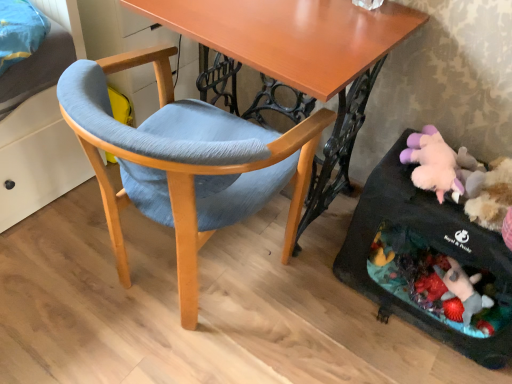
Question: Can you confirm if matte blue fabric chair at center is smaller than black fabric baby carriage at lower right?

Choices:
 (A) yes
 (B) no

Answer: (B)

Question: Are matte blue fabric chair at center and black fabric baby carriage at lower right far apart?

Choices:
 (A) yes
 (B) no

Answer: (B)

Question: Considering the relative sizes of matte blue fabric chair at center and black fabric baby carriage at lower right in the image provided, is matte blue fabric chair at center thinner than black fabric baby carriage at lower right?

Choices:
 (A) yes
 (B) no

Answer: (B)

Question: Considering the relative sizes of matte blue fabric chair at center and black fabric baby carriage at lower right in the image provided, is matte blue fabric chair at center shorter than black fabric baby carriage at lower right?

Choices:
 (A) yes
 (B) no

Answer: (B)

Question: From the image's perspective, is matte blue fabric chair at center below black fabric baby carriage at lower right?

Choices:
 (A) no
 (B) yes

Answer: (A)

Question: Is matte blue fabric chair at center taller than black fabric baby carriage at lower right?

Choices:
 (A) no
 (B) yes

Answer: (B)

Question: From a real-world perspective, does wooden desk at center stand above black fabric baby carriage at lower right?

Choices:
 (A) no
 (B) yes

Answer: (B)

Question: Does wooden desk at center turn towards black fabric baby carriage at lower right?

Choices:
 (A) yes
 (B) no

Answer: (B)

Question: Is wooden desk at center smaller than black fabric baby carriage at lower right?

Choices:
 (A) yes
 (B) no

Answer: (B)

Question: Is wooden desk at center in front of black fabric baby carriage at lower right?

Choices:
 (A) no
 (B) yes

Answer: (B)

Question: Does wooden desk at center appear on the right side of black fabric baby carriage at lower right?

Choices:
 (A) yes
 (B) no

Answer: (B)

Question: From a real-world perspective, is wooden desk at center under black fabric baby carriage at lower right?

Choices:
 (A) no
 (B) yes

Answer: (A)

Question: Is wooden desk at center surrounding matte blue fabric chair at center?

Choices:
 (A) yes
 (B) no

Answer: (A)